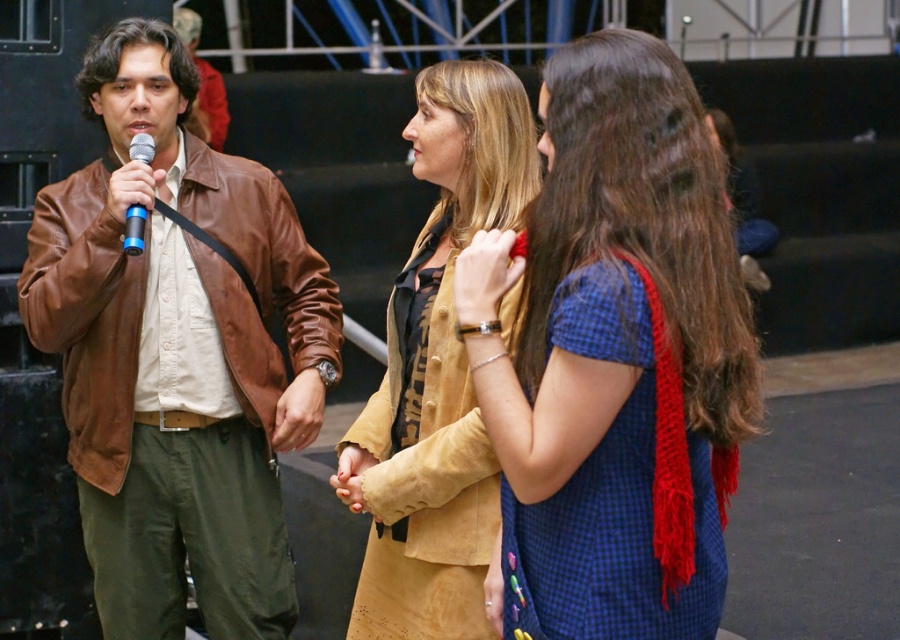
Question: Is brown leather jacket at left smaller than suede jacket at center?

Choices:
 (A) yes
 (B) no

Answer: (B)

Question: Considering the real-world distances, which object is farthest from the blue metallic microphone at left?

Choices:
 (A) brown leather jacket at left
 (B) suede jacket at center

Answer: (B)

Question: Among these objects, which one is nearest to the camera?

Choices:
 (A) blue checkered dress at center
 (B) suede jacket at center
 (C) blue metallic microphone at left
 (D) brown leather jacket at left

Answer: (A)

Question: Does blue checkered dress at center appear over suede jacket at center?

Choices:
 (A) yes
 (B) no

Answer: (A)

Question: Does blue checkered dress at center have a lesser width compared to suede jacket at center?

Choices:
 (A) yes
 (B) no

Answer: (B)

Question: Among these points, which one is nearest to the camera?

Choices:
 (A) (406, 413)
 (B) (680, 339)
 (C) (65, 196)

Answer: (B)